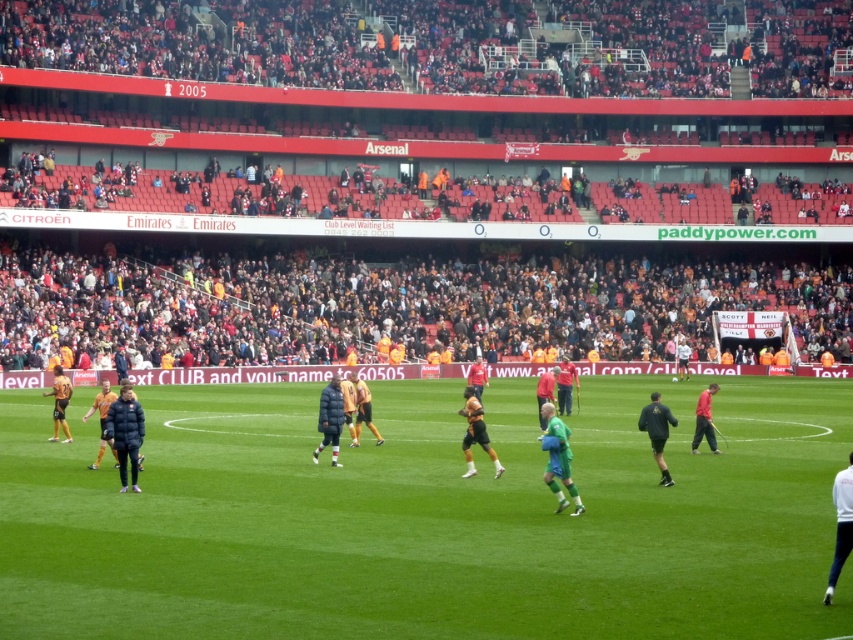
You are a photographer at the stadium and want to capture both the dark blue padded jacket at center and the black matte jacket at lower right in a single shot. Which jacket should you position your camera closer to in order to include both in the frame?

You should position your camera closer to the dark blue padded jacket at center because it is to the left of the black matte jacket at lower right, allowing both to be captured in the frame when centered.

Based on the photo, you are a photographer at the stadium and want to capture a wide shot of the entire green grass field at center and the red matte shirt at center. Which object will occupy more space in your photo?

The green grass field at center is bigger than the red matte shirt at center, so it will occupy more space in the photo.

You are standing at the edge of the football field and see two points marked on the field. The first point is at coordinates point (x=335, y=396) and the second point is at coordinates point (x=651, y=396). Which point is closer to you?

Point (x=335, y=396) is closer to the viewer than point (x=651, y=396).